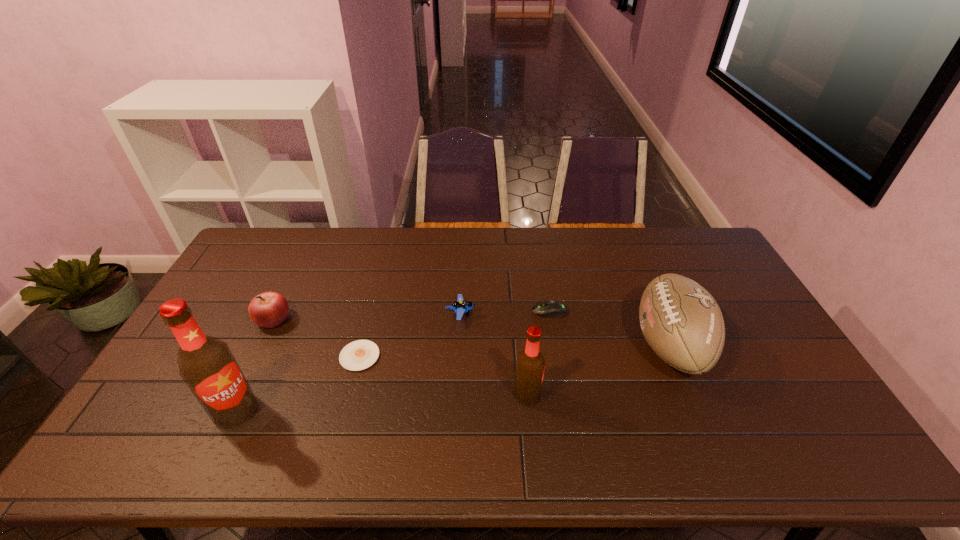
This screenshot has height=540, width=960. I want to click on vacant area that lies between the tallest object and the fourth tallest object, so click(x=254, y=365).

This screenshot has width=960, height=540. I want to click on vacant space that's between the shortest object and the sixth tallest object, so click(455, 334).

At what (x,y) coordinates should I click in order to perform the action: click on empty space that is in between the taller beer bottle and the apple. Please return your answer as a coordinate pair (x, y). The width and height of the screenshot is (960, 540). Looking at the image, I should click on (254, 365).

At what (x,y) coordinates should I click in order to perform the action: click on vacant space that is in between the third shortest object and the third object from left to right. Please return your answer as a coordinate pair (x, y). Looking at the image, I should click on (410, 335).

Find the location of `free area in between the fourth shortest object and the rightmost object`. free area in between the fourth shortest object and the rightmost object is located at coordinates (471, 332).

Locate an element on the screen. free space between the left beer bottle and the fourth tallest object is located at coordinates (254, 365).

This screenshot has height=540, width=960. What are the coordinates of `empty space that is in between the second object from right to left and the fourth tallest object` in the screenshot? It's located at (411, 315).

Where is `vacant region between the fourth tallest object and the shortest object`? vacant region between the fourth tallest object and the shortest object is located at coordinates (316, 338).

I want to click on vacant space that's between the sixth shortest object and the apple, so (x=400, y=357).

Choose which object is the sixth nearest neighbor to the fifth shortest object. Please provide its 2D coordinates. Your answer should be formatted as a tuple, i.e. [(x, y)], where the tuple contains the x and y coordinates of a point satisfying the conditions above.

[(269, 309)]